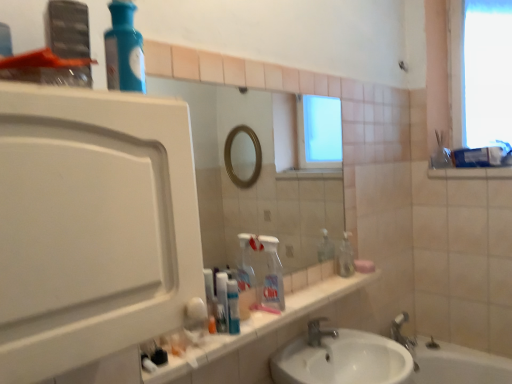
Where is `vacant area that is in front of silver metallic faucet at sink center`? The height and width of the screenshot is (384, 512). vacant area that is in front of silver metallic faucet at sink center is located at coordinates (324, 355).